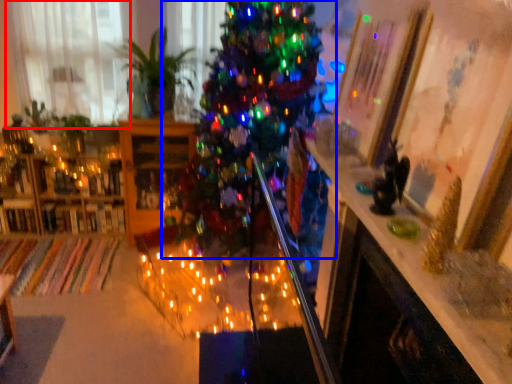
Question: Among these objects, which one is farthest to the camera, window (highlighted by a red box) or christmas tree (highlighted by a blue box)?

Choices:
 (A) window
 (B) christmas tree

Answer: (A)